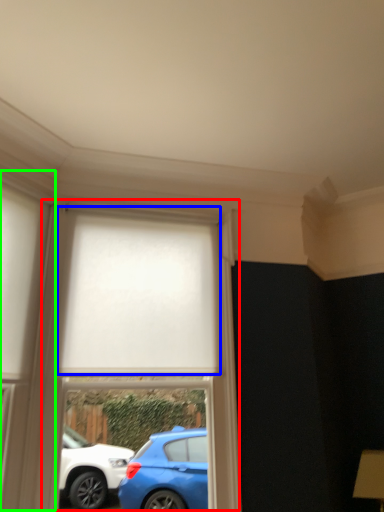
Question: Estimate the real-world distances between objects in this image. Which object is closer to bay window (highlighted by a red box), curtain (highlighted by a blue box) or glass door (highlighted by a green box)?

Choices:
 (A) curtain
 (B) glass door

Answer: (A)